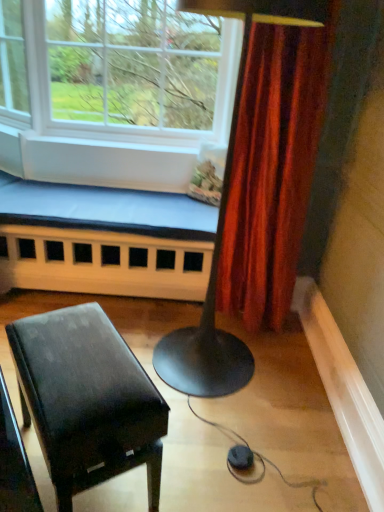
In order to face clear glass window at upper left, should I rotate leftwards or rightwards?

Turn left approximately 13.005 degrees to face it.

Where is `clear glass window at upper left`? clear glass window at upper left is located at coordinates (117, 70).

Between clear glass window at upper left and white wood church bench at lower left, which one has larger width?

With larger width is clear glass window at upper left.

Looking at this image, is the position of clear glass window at upper left more distant than that of white wood church bench at lower left?

No, it is in front of white wood church bench at lower left.

Is clear glass window at upper left shorter than white wood church bench at lower left?

No.

Between clear glass window at upper left and white wood church bench at lower left, which one appears on the left side from the viewer's perspective?

clear glass window at upper left is more to the left.

From the image's perspective, who appears lower, white wood church bench at lower left or glossy black piano at lower left?

glossy black piano at lower left, from the image's perspective.

Is the position of white wood church bench at lower left more distant than that of glossy black piano at lower left?

Yes, white wood church bench at lower left is further from the camera.

Is white wood church bench at lower left outside of glossy black piano at lower left?

Yes, white wood church bench at lower left is located beyond the bounds of glossy black piano at lower left.

From a real-world perspective, who is located higher, white wood church bench at lower left or clear glass window at upper left?

clear glass window at upper left, from a real-world perspective.

Is white wood church bench at lower left inside or outside of clear glass window at upper left?

white wood church bench at lower left cannot be found inside clear glass window at upper left.

Is the depth of white wood church bench at lower left less than that of clear glass window at upper left?

No, white wood church bench at lower left is further to the viewer.

Is point (192, 99) positioned before point (92, 314)?

No, it is behind (92, 314).

Is clear glass window at upper left surrounding glossy black piano at lower left?

No, glossy black piano at lower left is not inside clear glass window at upper left.

How far apart are clear glass window at upper left and glossy black piano at lower left?

The distance of clear glass window at upper left from glossy black piano at lower left is 5.91 feet.

Between clear glass window at upper left and glossy black piano at lower left, which one has more height?

clear glass window at upper left.

From the image's perspective, does glossy black piano at lower left appear lower than white wood church bench at lower left?

Yes, from the image's perspective, glossy black piano at lower left is beneath white wood church bench at lower left.

Is point (91, 425) farther from viewer compared to point (115, 219)?

No, (91, 425) is closer to viewer.

Considering the sizes of objects glossy black piano at lower left and white wood church bench at lower left in the image provided, who is thinner, glossy black piano at lower left or white wood church bench at lower left?

Thinner between the two is glossy black piano at lower left.

Do you think glossy black piano at lower left is within clear glass window at upper left, or outside of it?

glossy black piano at lower left exists outside the volume of clear glass window at upper left.

Can you tell me how much glossy black piano at lower left and clear glass window at upper left differ in facing direction?

There is a 57.3-degree angle between the facing directions of glossy black piano at lower left and clear glass window at upper left.

Is glossy black piano at lower left positioned with its back to clear glass window at upper left?

No, glossy black piano at lower left's orientation is not away from clear glass window at upper left.

This screenshot has height=512, width=384. I want to click on window that is above the white wood church bench at lower left (from the image's perspective), so click(117, 70).

You are a GUI agent. You are given a task and a screenshot of the screen. Output one action in this format:
    pyautogui.click(x=<x>, y=<y>)
    Task: Click on the church bench above the glossy black piano at lower left (from a real-world perspective)
    The width and height of the screenshot is (384, 512).
    Given the screenshot: What is the action you would take?
    pyautogui.click(x=104, y=241)

Looking at the image, which one is located closer to glossy black piano at lower left, white wood church bench at lower left or clear glass window at upper left?

The object closer to glossy black piano at lower left is white wood church bench at lower left.

From the image, which object appears to be farther from clear glass window at upper left, white wood church bench at lower left or glossy black piano at lower left?

glossy black piano at lower left is positioned further to the anchor clear glass window at upper left.

When comparing their distances from white wood church bench at lower left, does clear glass window at upper left or glossy black piano at lower left seem closer?

clear glass window at upper left lies closer to white wood church bench at lower left than the other object.

From the image, which object appears to be nearer to clear glass window at upper left, glossy black piano at lower left or white wood church bench at lower left?

white wood church bench at lower left lies closer to clear glass window at upper left than the other object.

Which object lies nearer to the anchor point glossy black piano at lower left, clear glass window at upper left or white wood church bench at lower left?

white wood church bench at lower left lies closer to glossy black piano at lower left than the other object.

Which object lies nearer to the anchor point white wood church bench at lower left, glossy black piano at lower left or clear glass window at upper left?

clear glass window at upper left is closer to white wood church bench at lower left.

You are a GUI agent. You are given a task and a screenshot of the screen. Output one action in this format:
    pyautogui.click(x=<x>, y=<y>)
    Task: Click on the church bench between clear glass window at upper left and glossy black piano at lower left in the up-down direction
    The height and width of the screenshot is (512, 384).
    Given the screenshot: What is the action you would take?
    pyautogui.click(x=104, y=241)